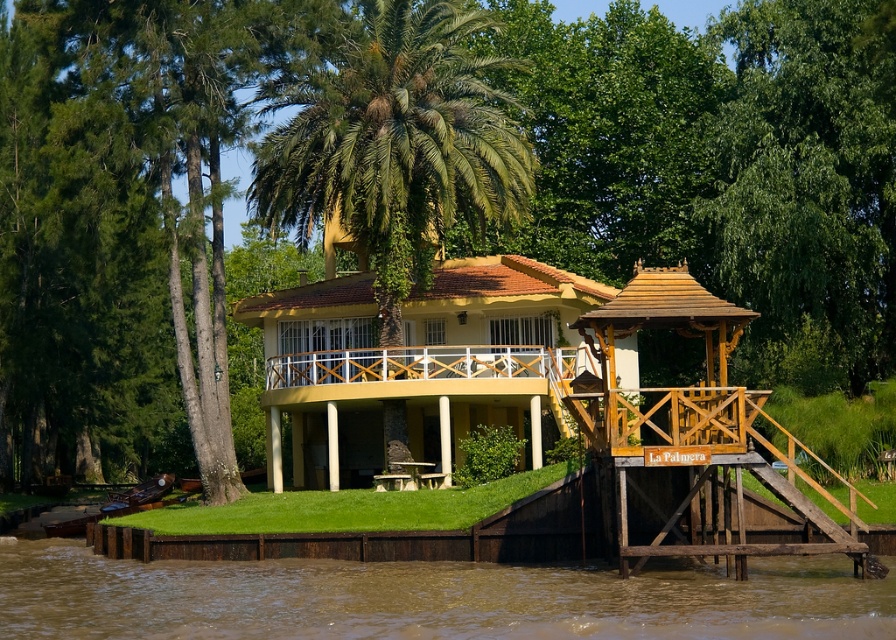
You are standing on the balcony of the yellow house with white trim. You notice a point marked at coordinates (428, 598). What is located at this point?

The point at coordinates (428, 598) indicates brown muddy water at lower left.

You are standing at the point with coordinates point (x=324, y=67) and want to walk towards the house entrance located at point (x=502, y=371). Since you can only move forward, will you be able to reach the entrance directly without needing to turn?

Yes, you can reach the entrance directly because point (x=324, y=67) is in front of point (x=502, y=371), meaning the entrance is directly ahead in your path.